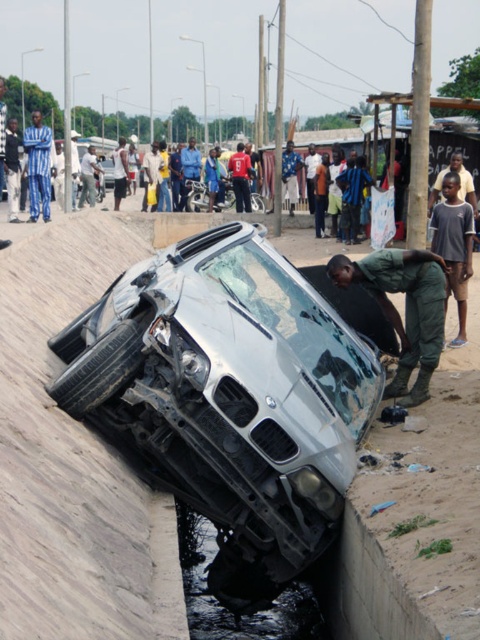
Question: Which object is farther from the camera taking this photo?

Choices:
 (A) silver metallic car at center
 (B) blue striped shirt at upper left

Answer: (A)

Question: Is black rubber flood at lower center above dark blue shirt at center?

Choices:
 (A) yes
 (B) no

Answer: (B)

Question: Is silver metallic car at lower center thinner than blue fabric pants at center?

Choices:
 (A) no
 (B) yes

Answer: (A)

Question: Which point is closer to the camera taking this photo?

Choices:
 (A) (0, 129)
 (B) (35, 134)

Answer: (B)

Question: Which point is closer to the camera taking this photo?

Choices:
 (A) (420, 348)
 (B) (235, 193)
 (C) (1, 189)

Answer: (A)

Question: Does red fabric shirt at center appear on the right side of dark blue shirt at center?

Choices:
 (A) no
 (B) yes

Answer: (B)